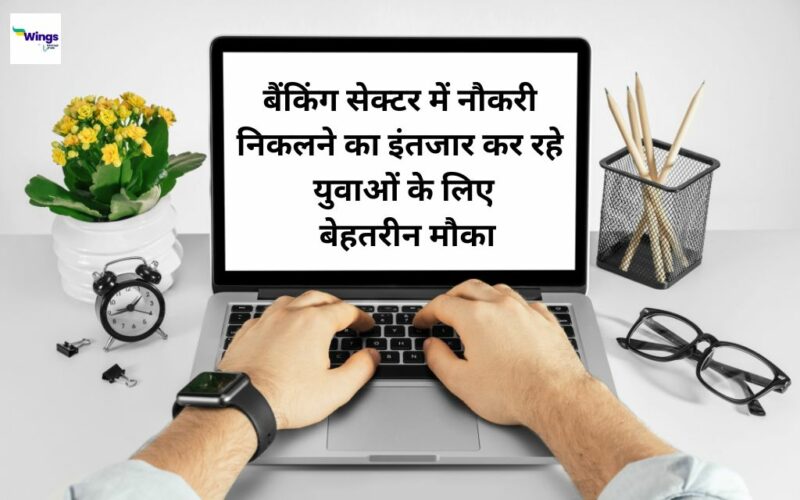
Where is `laptop trackpad`? laptop trackpad is located at coordinates (417, 434).